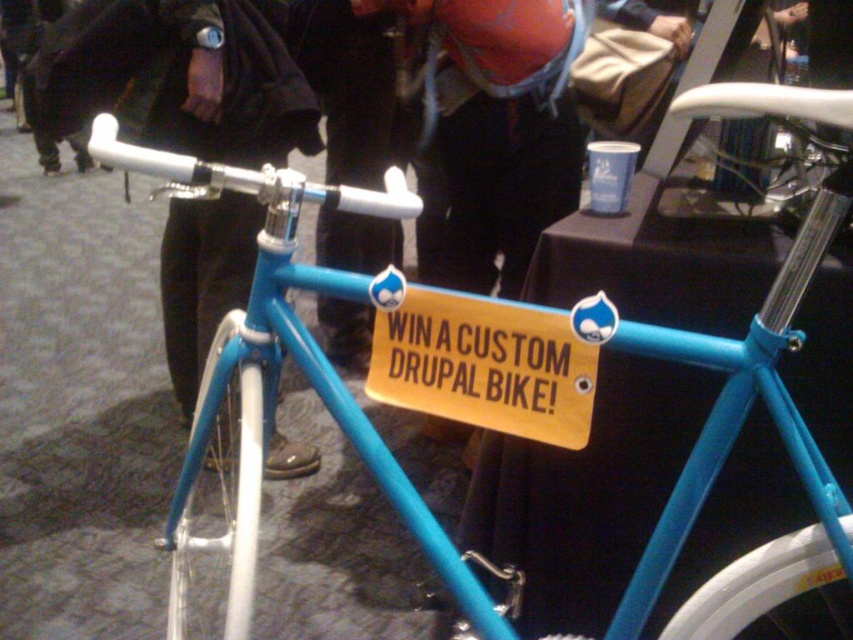
Does matte black jacket at center have a lesser width compared to yellow paper sign at center?

Incorrect, matte black jacket at center's width is not less than yellow paper sign at center's.

Is point (137, 67) more distant than point (421, 378)?

Yes, it is.

Image resolution: width=853 pixels, height=640 pixels. I want to click on matte black jacket at center, so click(178, 76).